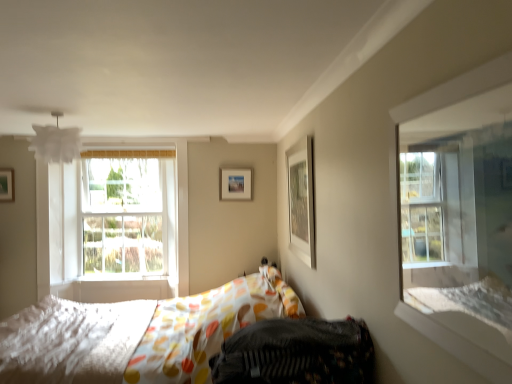
The width and height of the screenshot is (512, 384). I want to click on matte white picture frame at upper right, the 3th picture frame viewed from the left, so click(x=301, y=200).

Image resolution: width=512 pixels, height=384 pixels. Describe the element at coordinates (7, 185) in the screenshot. I see `matte white picture frame at upper left, the 2th picture frame in the back-to-front sequence` at that location.

The width and height of the screenshot is (512, 384). What do you see at coordinates (234, 184) in the screenshot? I see `matte wooden picture frame at center, arranged as the second picture frame when viewed from the right` at bounding box center [234, 184].

Find the location of a particular element. The width and height of the screenshot is (512, 384). patterned fabric bed at center is located at coordinates (137, 334).

Find the location of `matte white picture frame at upper right, the 3th picture frame viewed from the left`. matte white picture frame at upper right, the 3th picture frame viewed from the left is located at coordinates (301, 200).

Is patterned fabric bed at center taller than white textured mattress at lower left?

Yes.

Looking at this image, in terms of width, does patterned fabric bed at center look wider or thinner when compared to white textured mattress at lower left?

patterned fabric bed at center is wider than white textured mattress at lower left.

In the image, is patterned fabric bed at center positioned in front of or behind white textured mattress at lower left?

Visually, patterned fabric bed at center is located behind white textured mattress at lower left.

Can you confirm if matte white picture frame at upper left, acting as the second picture frame starting from the front, is taller than clear glass window at upper right?

No.

Is matte white picture frame at upper left, which is the 3th picture frame from right to left, oriented towards clear glass window at upper right?

No, matte white picture frame at upper left, which is the 3th picture frame from right to left, does not turn towards clear glass window at upper right.

Is matte white picture frame at upper left, acting as the second picture frame starting from the front, at the right side of clear glass window at upper right?

No.

Would you consider matte white picture frame at upper left, the 2th picture frame in the back-to-front sequence, to be distant from clear glass window at upper right?

Indeed, matte white picture frame at upper left, the 2th picture frame in the back-to-front sequence, is not near clear glass window at upper right.

Considering the relative positions of matte wooden picture frame at center, which appears as the 1th picture frame when viewed from the back, and white textured mattress at lower left in the image provided, is matte wooden picture frame at center, which appears as the 1th picture frame when viewed from the back, to the left of white textured mattress at lower left from the viewer's perspective?

No, matte wooden picture frame at center, which appears as the 1th picture frame when viewed from the back, is not to the left of white textured mattress at lower left.

Does matte wooden picture frame at center, placed as the third picture frame when sorted from front to back, have a greater width compared to white textured mattress at lower left?

Incorrect, the width of matte wooden picture frame at center, placed as the third picture frame when sorted from front to back, does not surpass that of white textured mattress at lower left.

Is matte wooden picture frame at center, arranged as the second picture frame when viewed from the right, looking in the opposite direction of white textured mattress at lower left?

No, matte wooden picture frame at center, arranged as the second picture frame when viewed from the right, is not facing away from white textured mattress at lower left.

Considering the sizes of matte white picture frame at upper left, the 2th picture frame in the back-to-front sequence, and white textured mattress at lower left in the image, is matte white picture frame at upper left, the 2th picture frame in the back-to-front sequence, bigger or smaller than white textured mattress at lower left?

In the image, matte white picture frame at upper left, the 2th picture frame in the back-to-front sequence, appears to be smaller than white textured mattress at lower left.

Who is shorter, matte white picture frame at upper left, placed as the 1th picture frame when sorted from left to right, or white textured mattress at lower left?

matte white picture frame at upper left, placed as the 1th picture frame when sorted from left to right.

From the picture: From the image's perspective, between matte white picture frame at upper left, which is the 3th picture frame from right to left, and white textured mattress at lower left, which one is located above?

From the image's view, matte white picture frame at upper left, which is the 3th picture frame from right to left, is above.

Is point (88, 326) positioned in front of point (4, 179)?

Yes, it is in front of point (4, 179).

From a real-world perspective, is white textured mattress at lower left physically below matte white picture frame at upper left, placed as the 1th picture frame when sorted from left to right?

Correct, in the physical world, white textured mattress at lower left is lower than matte white picture frame at upper left, placed as the 1th picture frame when sorted from left to right.

Does white textured mattress at lower left touch matte white picture frame at upper left, which is the 3th picture frame from right to left?

No, white textured mattress at lower left is not with matte white picture frame at upper left, which is the 3th picture frame from right to left.

Is white textured mattress at lower left located outside matte white picture frame at upper left, placed as the 1th picture frame when sorted from left to right?

white textured mattress at lower left is positioned outside matte white picture frame at upper left, placed as the 1th picture frame when sorted from left to right.

Relative to patterned fabric bed at center, is matte white picture frame at upper left, placed as the 1th picture frame when sorted from left to right, in front or behind?

Clearly, matte white picture frame at upper left, placed as the 1th picture frame when sorted from left to right, is behind patterned fabric bed at center.

Measure the distance from matte white picture frame at upper left, acting as the second picture frame starting from the front, to patterned fabric bed at center.

matte white picture frame at upper left, acting as the second picture frame starting from the front, is 7.19 feet away from patterned fabric bed at center.

Can you confirm if matte white picture frame at upper left, the 2th picture frame in the back-to-front sequence, is shorter than patterned fabric bed at center?

Correct, matte white picture frame at upper left, the 2th picture frame in the back-to-front sequence, is not as tall as patterned fabric bed at center.

At what (x,y) coordinates should I click in order to perform the action: click on the 2nd picture frame behind the patterned fabric bed at center. Please return your answer as a coordinate pair (x, y). Image resolution: width=512 pixels, height=384 pixels. Looking at the image, I should click on (7, 185).

Based on the photo, between clear glass window at upper right and matte wooden picture frame at center, arranged as the second picture frame when viewed from the right, which one appears on the left side from the viewer's perspective?

matte wooden picture frame at center, arranged as the second picture frame when viewed from the right.

Is clear glass window at upper right looking in the opposite direction of matte wooden picture frame at center, placed as the third picture frame when sorted from front to back?

clear glass window at upper right is not turned away from matte wooden picture frame at center, placed as the third picture frame when sorted from front to back.

From a real-world perspective, between clear glass window at upper right and matte wooden picture frame at center, placed as the third picture frame when sorted from front to back, who is vertically higher?

From a 3D spatial view, matte wooden picture frame at center, placed as the third picture frame when sorted from front to back, is above.

In the image, there is a white textured mattress at lower left. Where is `bed above it (from the image's perspective)`? This screenshot has width=512, height=384. bed above it (from the image's perspective) is located at coordinates (137, 334).

Locate an element on the screen. The image size is (512, 384). the 3rd picture frame to the left of the clear glass window at upper right, counting from the anchor's position is located at coordinates (7, 185).

Based on their spatial positions, is white textured mattress at lower left or matte white picture frame at upper left, which is the 3th picture frame from right to left, closer to matte white picture frame at upper right, placed as the first picture frame when sorted from front to back?

Among the two, white textured mattress at lower left is located nearer to matte white picture frame at upper right, placed as the first picture frame when sorted from front to back.

Based on the photo, considering their positions, is matte white picture frame at upper left, which is the 3th picture frame from right to left, positioned further to clear glass window at upper right than patterned fabric bed at center?

matte white picture frame at upper left, which is the 3th picture frame from right to left, is further to clear glass window at upper right.

Considering their positions, is matte white picture frame at upper left, placed as the 1th picture frame when sorted from left to right, positioned closer to patterned fabric bed at center than matte white picture frame at upper right, the 3th picture frame viewed from the left?

Among the two, matte white picture frame at upper right, the 3th picture frame viewed from the left, is located nearer to patterned fabric bed at center.

In the scene shown: Estimate the real-world distances between objects in this image. Which object is further from matte white picture frame at upper right, the 3th picture frame viewed from the left, clear glass window at upper right or white textured mattress at lower left?

Based on the image, white textured mattress at lower left appears to be further to matte white picture frame at upper right, the 3th picture frame viewed from the left.

When comparing their distances from matte wooden picture frame at center, which appears as the 1th picture frame when viewed from the back, does clear glass window at upper right or patterned fabric bed at center seem further?

Based on the image, clear glass window at upper right appears to be further to matte wooden picture frame at center, which appears as the 1th picture frame when viewed from the back.

Looking at the image, which one is located further to matte wooden picture frame at center, placed as the third picture frame when sorted from front to back, matte white picture frame at upper left, acting as the second picture frame starting from the front, or patterned fabric bed at center?

matte white picture frame at upper left, acting as the second picture frame starting from the front.

Estimate the real-world distances between objects in this image. Which object is further from clear glass window at upper right, white textured mattress at lower left or matte white picture frame at upper right, the 1th picture frame positioned from the right?

The object further to clear glass window at upper right is white textured mattress at lower left.

Looking at this image, based on their spatial positions, is matte white picture frame at upper left, the 2th picture frame in the back-to-front sequence, or patterned fabric bed at center further from white textured mattress at lower left?

matte white picture frame at upper left, the 2th picture frame in the back-to-front sequence, lies further to white textured mattress at lower left than the other object.

I want to click on bed between matte white picture frame at upper left, placed as the 1th picture frame when sorted from left to right, and matte white picture frame at upper right, the 3th picture frame viewed from the left, in the horizontal direction, so click(137, 334).

Locate an element on the screen. The image size is (512, 384). bed between white textured mattress at lower left and matte white picture frame at upper left, which is the 3th picture frame from right to left, along the z-axis is located at coordinates (137, 334).

At what (x,y) coordinates should I click in order to perform the action: click on bed between white textured mattress at lower left and matte white picture frame at upper right, which ranks as the 3th picture frame in back-to-front order, in the horizontal direction. Please return your answer as a coordinate pair (x, y). Looking at the image, I should click on (137, 334).

The width and height of the screenshot is (512, 384). I want to click on bed positioned between clear glass window at upper right and matte wooden picture frame at center, placed as the third picture frame when sorted from front to back, from near to far, so click(137, 334).